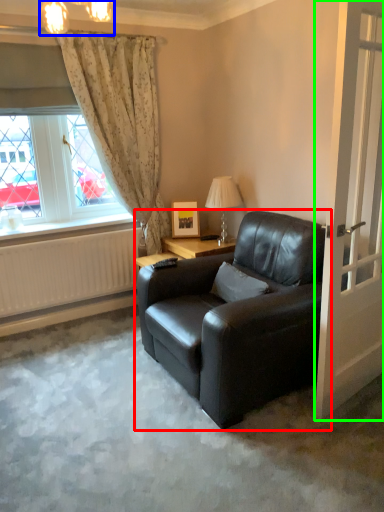
Question: Which is farther away from chair (highlighted by a red box)? lamp (highlighted by a blue box) or door (highlighted by a green box)?

Choices:
 (A) lamp
 (B) door

Answer: (A)